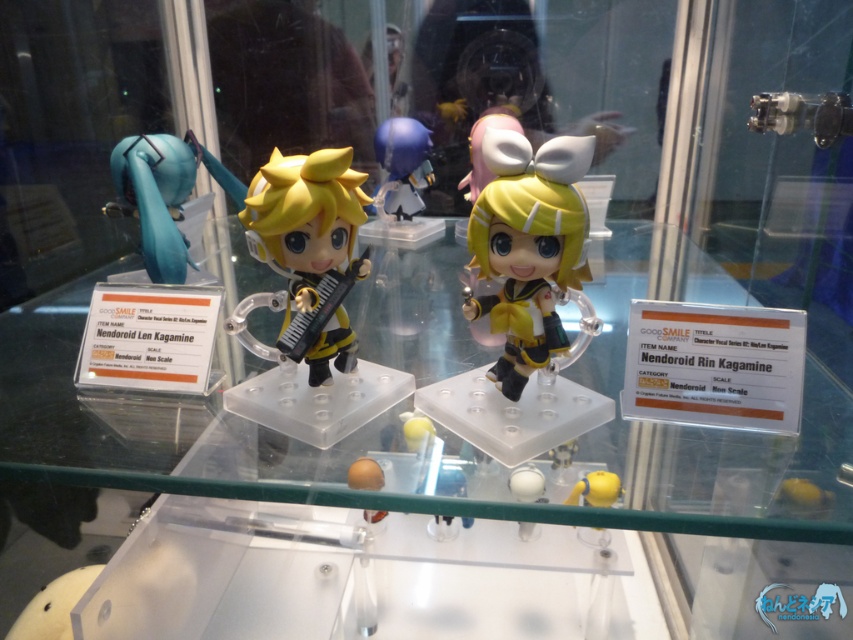
You are a collector who wants to know if the yellow matte nendoroid rin kagamine at center can fit into a storage box designed for the matte blue figure at center. Based on the display case description, will it fit?

The yellow matte nendoroid rin kagamine at center is larger in size compared to the matte blue figure at center, so it will not fit into a storage box designed for the smaller matte blue figure at center.

You are a photographer standing in front of the display case. You want to take a closeup photo of the Nendoroid Len Kagamine on the left side and the point at coordinates (x=578, y=227). Which object is closer to your camera?

The point at coordinates (x=578, y=227) is 84.01 centimeters from the camera, so it is closer than the Nendoroid Len Kagamine on the left side.